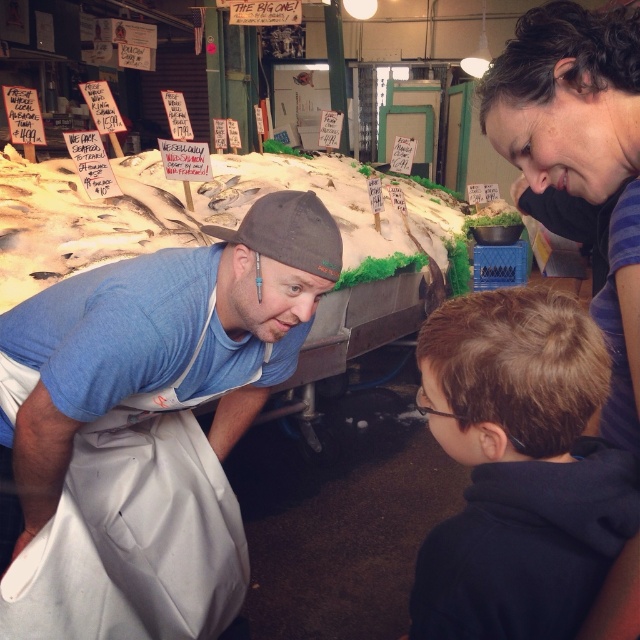
Which of these two, blue fabric shirt at lower left or brown fabric baseball cap at center, stands taller?

With more height is blue fabric shirt at lower left.

Which is in front, point (19, 522) or point (324, 275)?

Point (324, 275)

Does point (140, 296) lie behind point (260, 209)?

No, it is in front of (260, 209).

The image size is (640, 640). What are the coordinates of `blue fabric shirt at lower left` in the screenshot? It's located at (161, 340).

Does white fish at center appear on the left side of dark brown curly hair at upper right?

Correct, you'll find white fish at center to the left of dark brown curly hair at upper right.

Is the position of white fish at center less distant than that of dark brown curly hair at upper right?

No, white fish at center is further to the viewer.

Which is behind, point (115, 164) or point (612, 164)?

The point (115, 164) is more distant.

This screenshot has width=640, height=640. Find the location of `white fish at center`. white fish at center is located at coordinates coord(196,216).

Does dark blue hoodie at lower right have a greater height compared to white fish at center?

Incorrect, dark blue hoodie at lower right's height is not larger of white fish at center's.

Can you confirm if dark blue hoodie at lower right is shorter than white fish at center?

Correct, dark blue hoodie at lower right is not as tall as white fish at center.

Who is more distant from viewer, [496,380] or [305,177]?

The point [305,177] is more distant.

Find the location of a particular element. The width and height of the screenshot is (640, 640). dark blue hoodie at lower right is located at coordinates (518, 468).